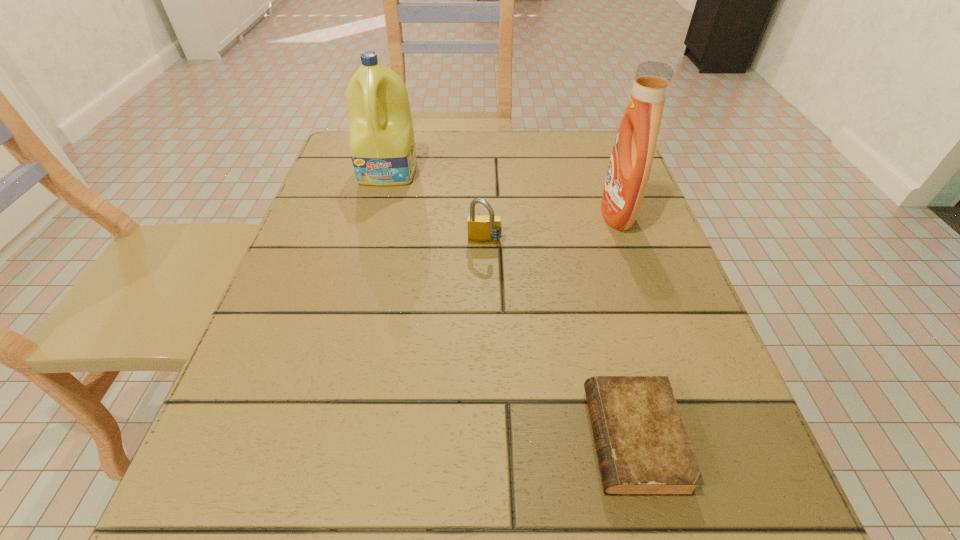
Locate an element on the screen. the third closest object relative to the shortest object is located at coordinates (382, 147).

This screenshot has height=540, width=960. Identify the location of free location that satisfies the following two spatial constraints: 1. on the front-facing side of the nearer detergent; 2. on the side with the combination dials of the second object from left to right. (627, 244).